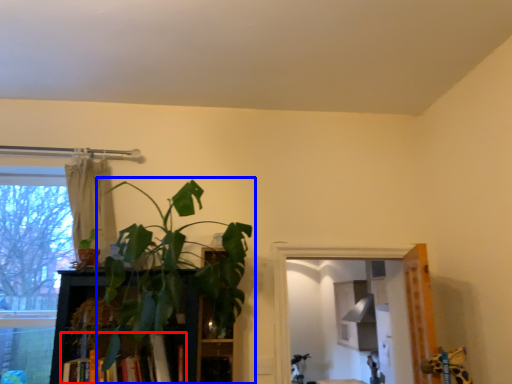
Question: Which object is further to the camera taking this photo, book (highlighted by a red box) or houseplant (highlighted by a blue box)?

Choices:
 (A) book
 (B) houseplant

Answer: (A)